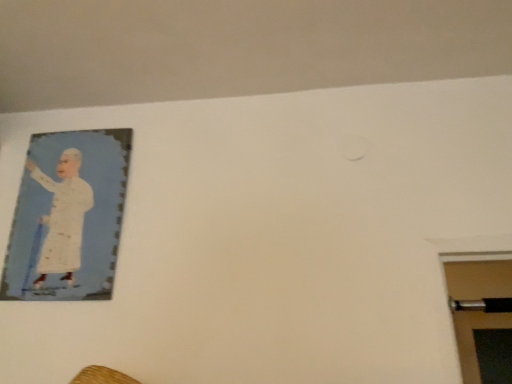
The image size is (512, 384). In order to click on matte cardboard picture frame at upper left in this screenshot , I will do `click(68, 217)`.

What is the approximate height of matte cardboard picture frame at upper left?

matte cardboard picture frame at upper left is 20.93 inches tall.

What do you see at coordinates (68, 217) in the screenshot? I see `matte cardboard picture frame at upper left` at bounding box center [68, 217].

Identify the location of matte cardboard picture frame at upper left. Image resolution: width=512 pixels, height=384 pixels. (68, 217).